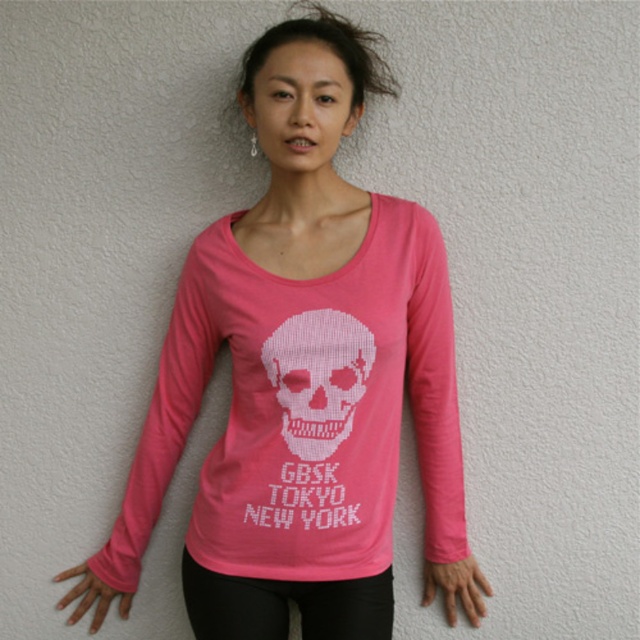
You are a fashion designer preparing for a photoshoot. You need to decide whether the black matte leggings at lower center and the white knitted skull at center will be visible in the final shot. Given that the camera lens can only capture objects larger than 5 cm, can you confirm if both items will be visible?

The black matte leggings at lower center has a larger size compared to the white knitted skull at center. Since the camera lens requires objects to be larger than 5 cm, and the leggings are larger, they will be visible. However, the visibility of the skull depends on its actual size. Without specific measurements, we cannot confirm if it meets the 5 cm requirement.

You are a fashion designer observing the image. You need to place a small accessory on the person, either on the matte pink hand at lower center or the pink matte hand at lower left. Which hand should you choose if you want the accessory to be visible to someone standing directly in front of the person?

The matte pink hand at lower center is positioned on the right side of the pink matte hand at lower left, so placing the accessory on the matte pink hand at lower center would make it more visible to someone standing directly in front of the person.